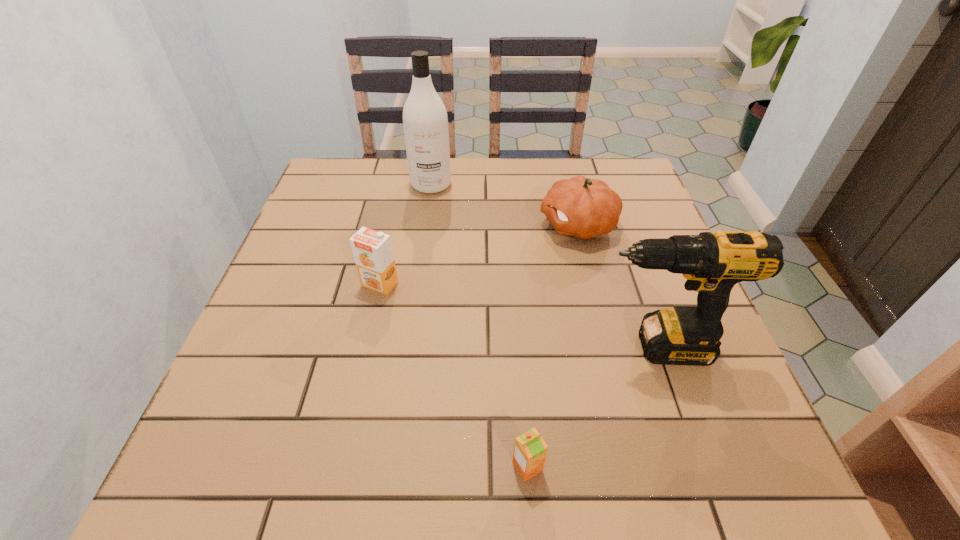
Locate which object is the third closest to the second nearest object. Please provide its 2D coordinates. Your answer should be formatted as a tuple, i.e. [(x, y)], where the tuple contains the x and y coordinates of a point satisfying the conditions above.

[(372, 250)]

At what (x,y) coordinates should I click in order to perform the action: click on object that stands as the fourth closest to the drill. Please return your answer as a coordinate pair (x, y). Looking at the image, I should click on (425, 121).

At what (x,y) coordinates should I click in order to perform the action: click on vacant position in the image that satisfies the following two spatial constraints: 1. on the front-facing side of the right orange juice; 2. on the left side of the tallest object. Please return your answer as a coordinate pair (x, y). Looking at the image, I should click on (392, 467).

Find the location of a particular element. free space that satisfies the following two spatial constraints: 1. on the front-facing side of the shampoo; 2. on the right side of the shorter orange juice is located at coordinates (392, 467).

This screenshot has height=540, width=960. In order to click on vacant space that satisfies the following two spatial constraints: 1. at the tip of the second tallest object; 2. on the front side of the nearer orange juice in this screenshot , I will do `click(696, 467)`.

Find the location of a particular element. free space that satisfies the following two spatial constraints: 1. on the front face of the second farthest object; 2. on the front side of the third nearest object is located at coordinates (592, 284).